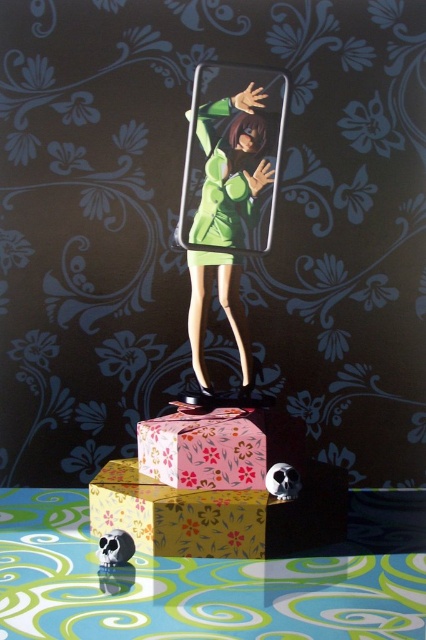
Looking at this image, what are the coordinates of the pink floral paper box at center?

The pink floral paper box at center is located at coordinates point [204,449].